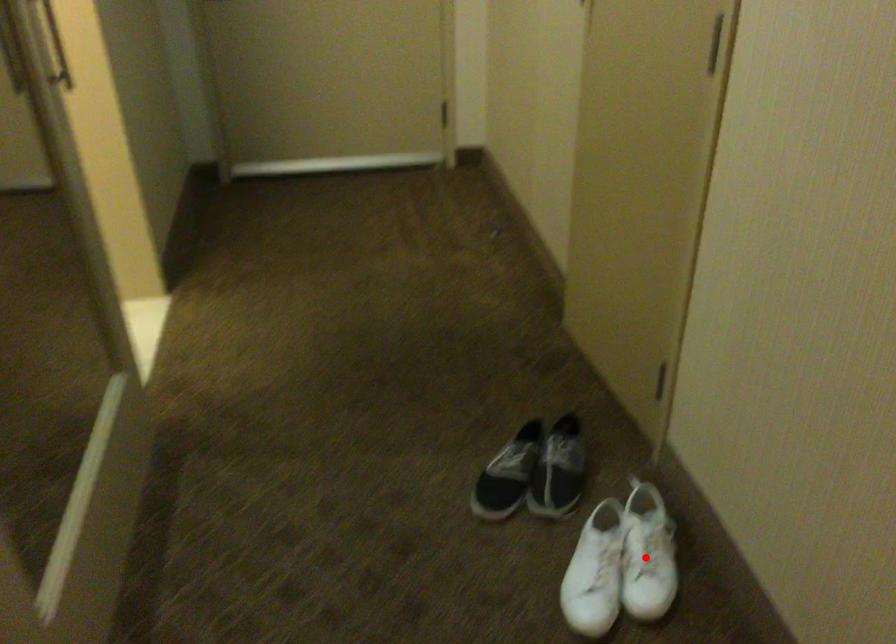
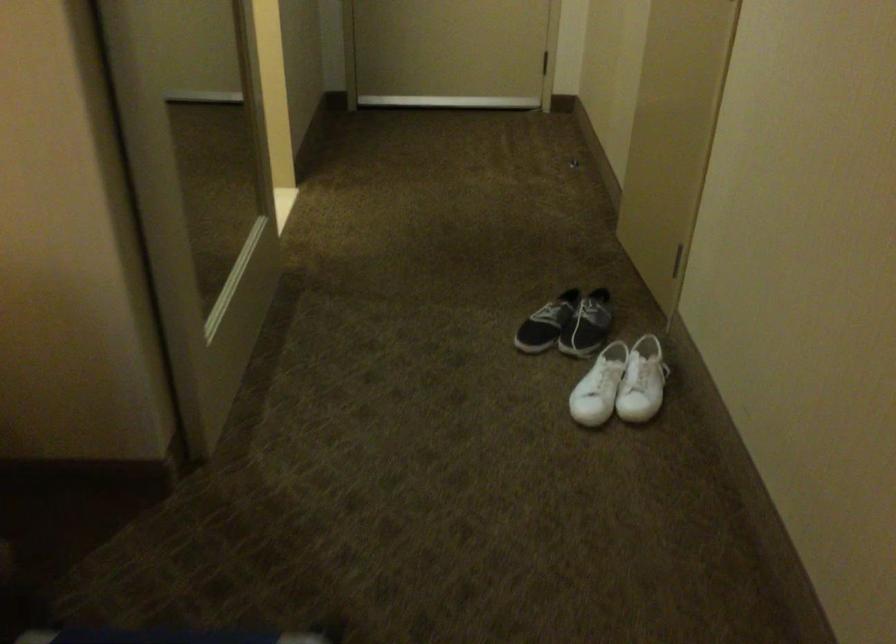
Question: A red point is marked in image1. In image2, is the corresponding 3D point closer to the camera or farther? Reply with the corresponding letter.

Choices:
 (A) The corresponding 3D point is closer.
 (B) The corresponding 3D point is farther.

Answer: (B)